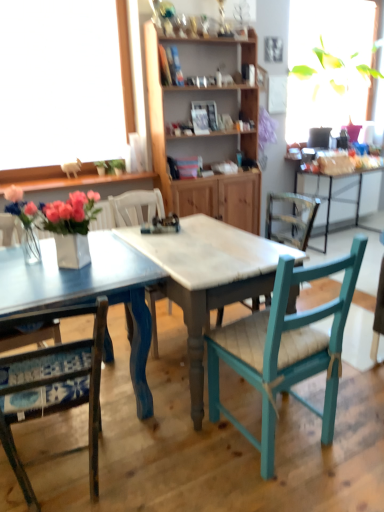
Question: Can you confirm if teal wood chair at center, the 1th chair viewed from the right, is smaller than white glossy vase at center?

Choices:
 (A) no
 (B) yes

Answer: (A)

Question: Is teal wood chair at center, the 1th chair viewed from the right, to the left of white glossy vase at center from the viewer's perspective?

Choices:
 (A) yes
 (B) no

Answer: (B)

Question: Considering the relative sizes of teal wood chair at center, the third chair when ordered from left to right, and white glossy vase at center in the image provided, is teal wood chair at center, the third chair when ordered from left to right, bigger than white glossy vase at center?

Choices:
 (A) no
 (B) yes

Answer: (B)

Question: Is teal wood chair at center, the 1th chair viewed from the right, turned away from white glossy vase at center?

Choices:
 (A) yes
 (B) no

Answer: (B)

Question: Based on their sizes in the image, would you say white glossy vase at center is bigger or smaller than teal wood chair at center, the 1th chair viewed from the right?

Choices:
 (A) big
 (B) small

Answer: (B)

Question: From the image's perspective, is white glossy vase at center located above or below teal wood chair at center, the third chair when ordered from left to right?

Choices:
 (A) below
 (B) above

Answer: (B)

Question: Is white glossy vase at center inside the boundaries of teal wood chair at center, the 1th chair viewed from the right, or outside?

Choices:
 (A) inside
 (B) outside

Answer: (B)

Question: Is point [x=8, y=205] positioned closer to the camera than point [x=215, y=334]?

Choices:
 (A) closer
 (B) farther

Answer: (B)

Question: Does point (294, 374) appear closer or farther from the camera than point (99, 376)?

Choices:
 (A) closer
 (B) farther

Answer: (B)

Question: From the image's perspective, is teal wood chair at center, the third chair when ordered from left to right, located above or below blue fabric cushioned chair at lower left, the 1th chair in the left-to-right sequence?

Choices:
 (A) above
 (B) below

Answer: (A)

Question: Considering the positions of teal wood chair at center, the third chair when ordered from left to right, and blue fabric cushioned chair at lower left, the third chair positioned from the right, in the image, is teal wood chair at center, the third chair when ordered from left to right, wider or thinner than blue fabric cushioned chair at lower left, the third chair positioned from the right,?

Choices:
 (A) thin
 (B) wide

Answer: (B)

Question: In the image, is teal wood chair at center, the third chair when ordered from left to right, positioned in front of or behind blue fabric cushioned chair at lower left, the third chair positioned from the right?

Choices:
 (A) behind
 (B) front

Answer: (A)

Question: Considering the positions of wooden cabinet at center and blue painted wood table at center in the image, is wooden cabinet at center taller or shorter than blue painted wood table at center?

Choices:
 (A) tall
 (B) short

Answer: (A)

Question: Is point (185, 145) positioned closer to the camera than point (248, 415)?

Choices:
 (A) closer
 (B) farther

Answer: (B)